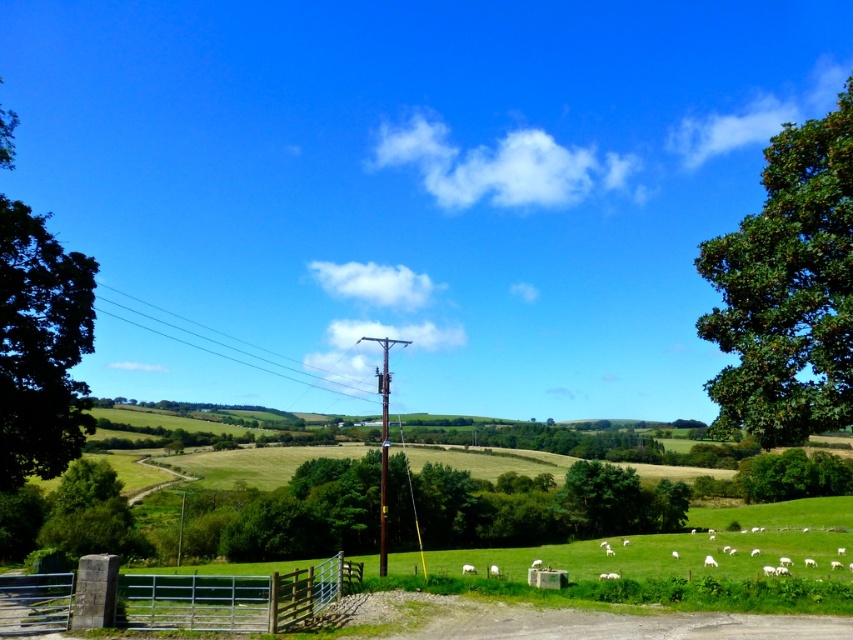
You are standing at the edge of the dirt path and want to take a photo of both the green leafy tree at right and the metallic silver gate at lower center. Which object should you focus on first to ensure both are in frame?

You should focus on the metallic silver gate at lower center first because the green leafy tree at right is much taller, so adjusting the camera angle to include its height while keeping the gate in view requires starting with the closer object.

You are a farmer standing at the edge of the field near the metallic silver gate at lower center. You want to reach the green leafy tree at right to check its health. Considering their sizes, which object will you encounter first as you walk towards the tree?

The metallic silver gate at lower center is larger than the green leafy tree at right, so you will encounter the metallic silver gate at lower center first as it is closer to you.